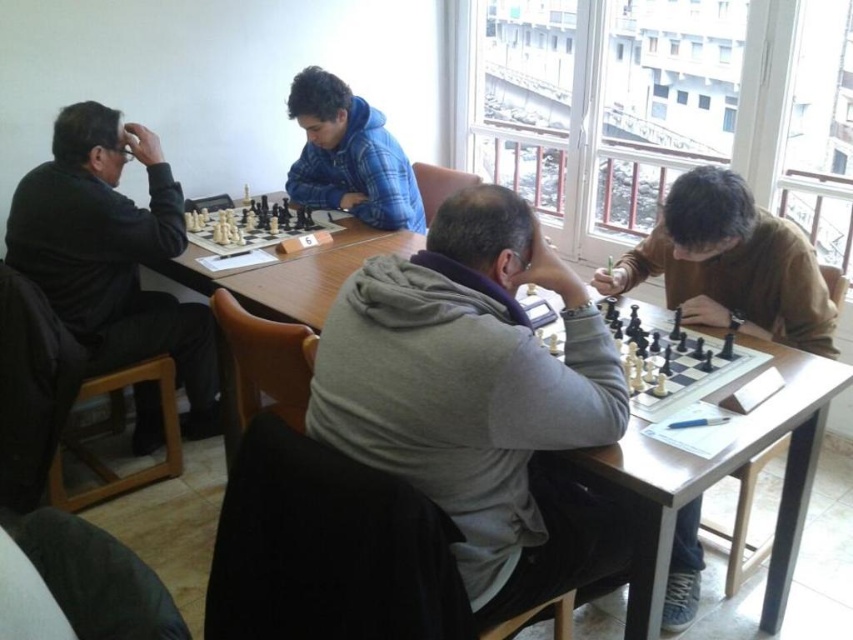
Question: Is brown cotton shirt at center further to the viewer compared to white plastic chess set at lower right?

Choices:
 (A) yes
 (B) no

Answer: (A)

Question: Based on their relative distances, which object is farther from the black matte jacket at left?

Choices:
 (A) blue plaid hoodie at center
 (B) wooden table at center
 (C) brown cotton shirt at center

Answer: (C)

Question: Which point appears closest to the camera in this image?

Choices:
 (A) 540,339
 (B) 194,240

Answer: (A)

Question: Where is wooden table at center located in relation to black plastic chess set at center in the image?

Choices:
 (A) above
 (B) below

Answer: (B)

Question: Is black matte jacket at left thinner than brown cotton shirt at center?

Choices:
 (A) no
 (B) yes

Answer: (B)

Question: Estimate the real-world distances between objects in this image. Which object is farther from the black plastic chess set at center?

Choices:
 (A) brown cotton shirt at center
 (B) white plastic chess set at lower right

Answer: (A)